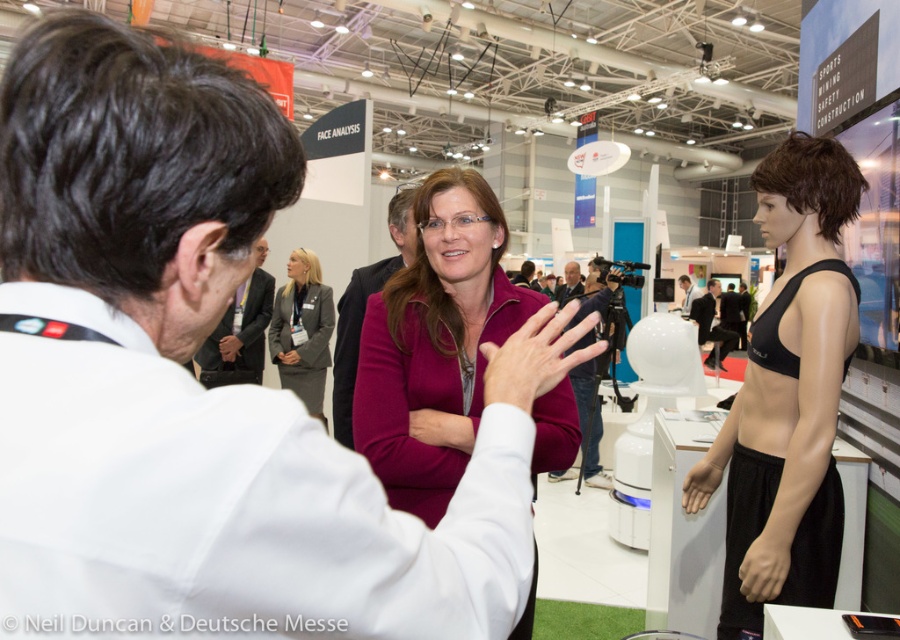
You are attending the trade fair and notice two items displayed at the center of the booth. The items are the matte black bra at center and the purple matte jacket at center. From the perspective of someone standing in front of the booth, which item is positioned to the right?

The matte black bra at center is to the right of the purple matte jacket at center.

What is the color and texture of the clothing item located at point [364,308]?

The clothing item at point [364,308] is a purple matte sweater.